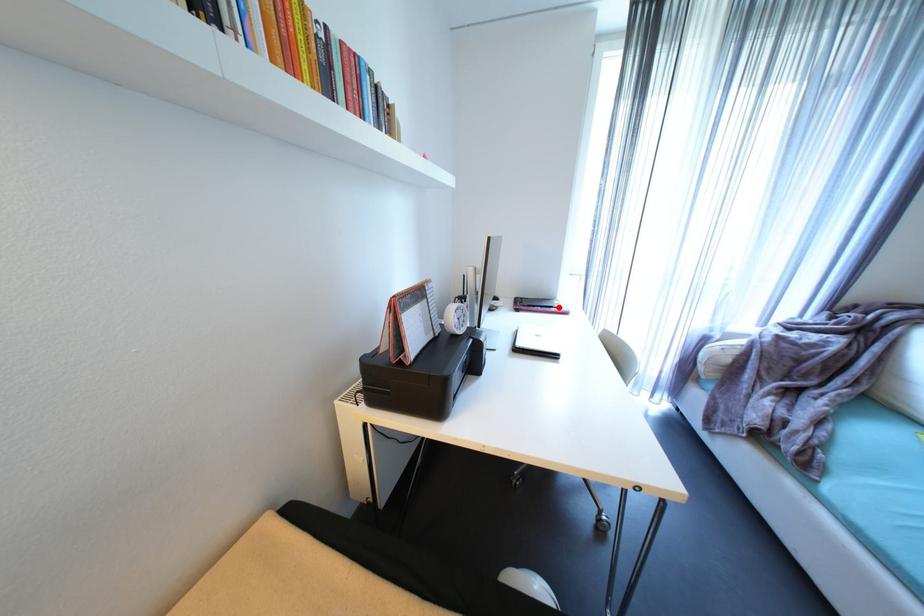
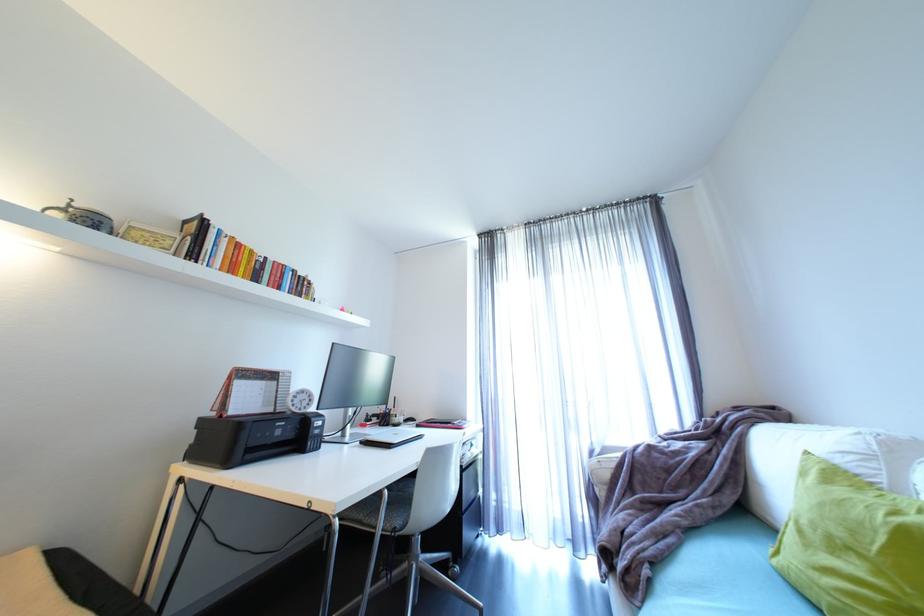
Question: I am providing you with two images of the same scene from different viewpoints. A red point is marked on the first image. Is the red point's position out of view in image 2?

Choices:
 (A) Yes
 (B) No

Answer: (B)